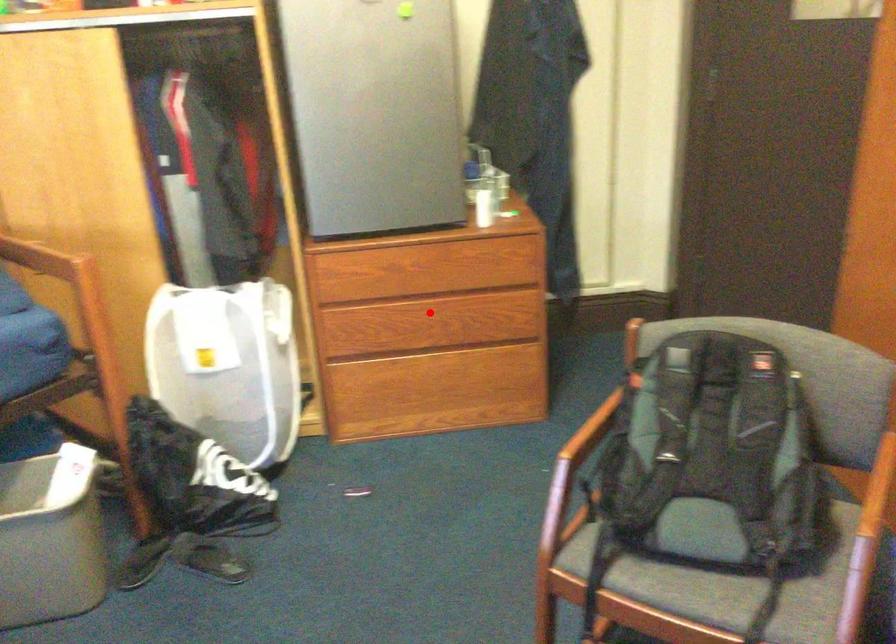
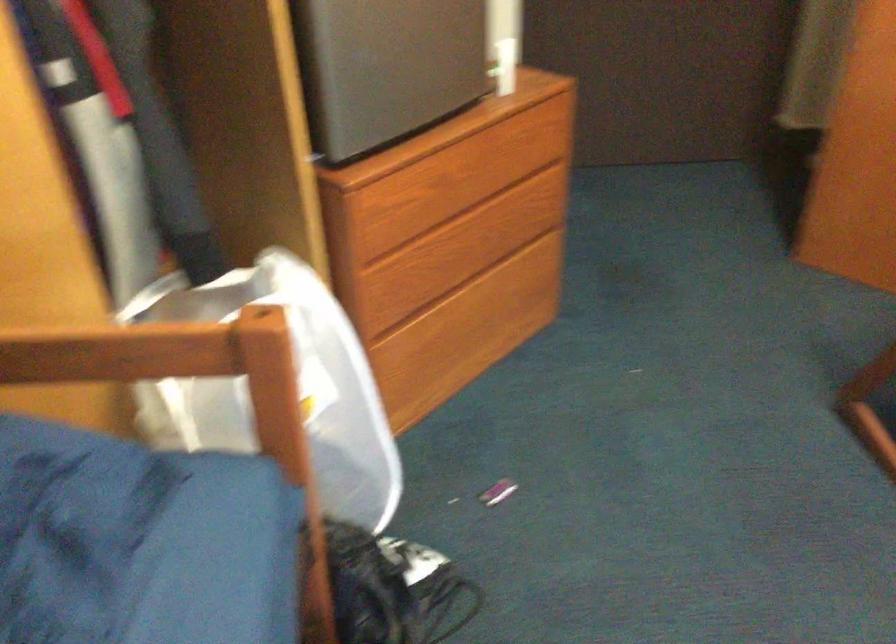
Question: I am providing you with two images of the same scene from different viewpoints. A red point is shown in image1. For the corresponding object point in image2, is it positioned nearer or farther from the camera?

Choices:
 (A) Nearer
 (B) Farther

Answer: (A)